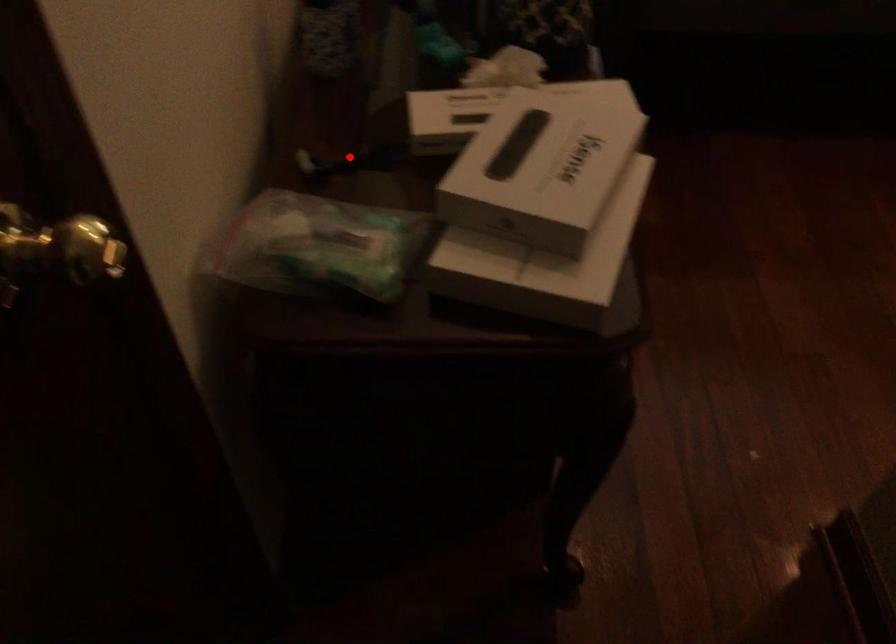
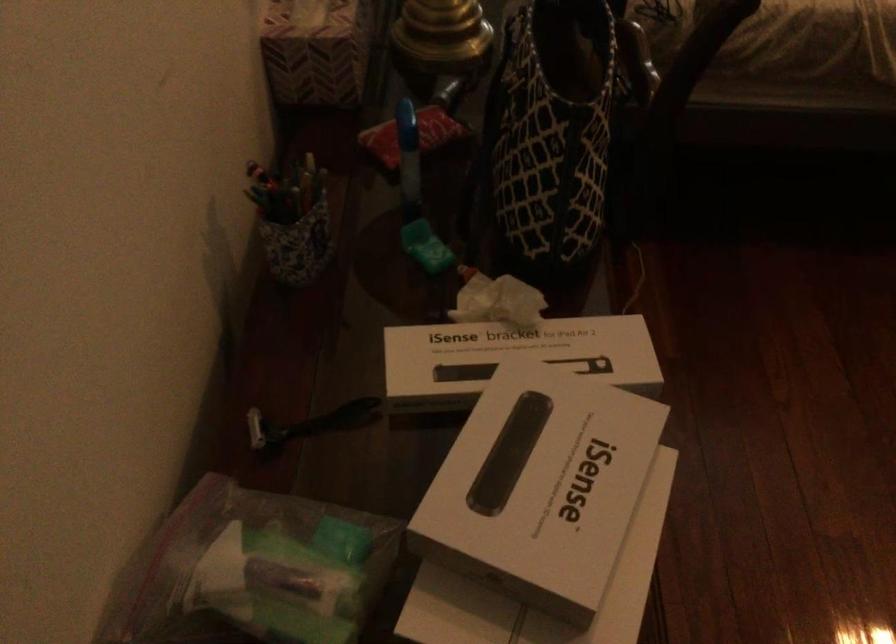
Question: I am providing you with two images of the same scene from different viewpoints. A red point is shown in image1. For the corresponding object point in image2, is it positioned nearer or farther from the camera?

Choices:
 (A) Nearer
 (B) Farther

Answer: (A)